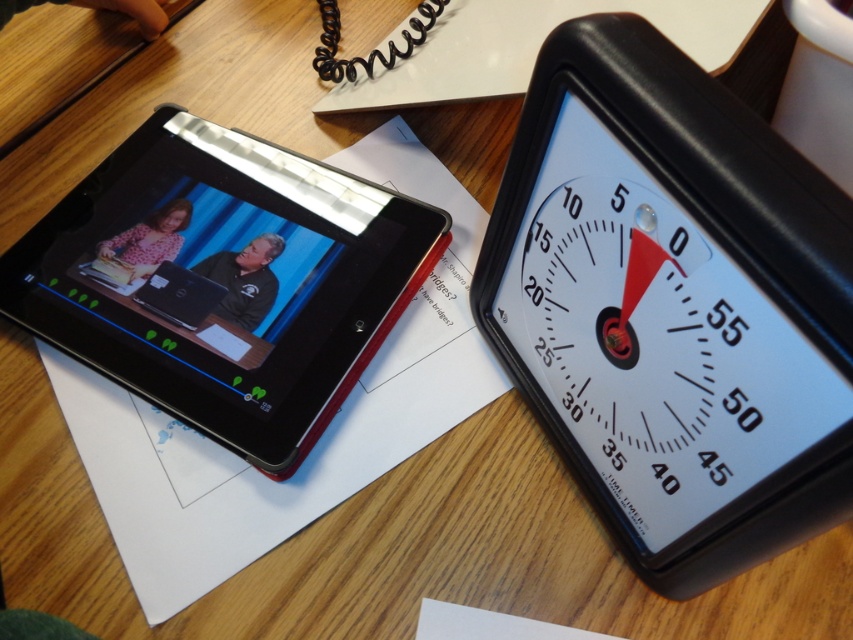
Question: Does white plastic timer at upper right appear on the right side of black plastic tablet at left?

Choices:
 (A) no
 (B) yes

Answer: (B)

Question: From the image, what is the correct spatial relationship of white plastic timer at upper right in relation to black plastic tablet at left?

Choices:
 (A) above
 (B) below

Answer: (B)

Question: Which point appears farthest from the camera in this image?

Choices:
 (A) (838, 202)
 (B) (45, 296)

Answer: (B)

Question: Which point is farther to the camera?

Choices:
 (A) (76, 298)
 (B) (659, 474)

Answer: (A)

Question: Is white plastic timer at upper right bigger than black plastic tablet at left?

Choices:
 (A) yes
 (B) no

Answer: (B)